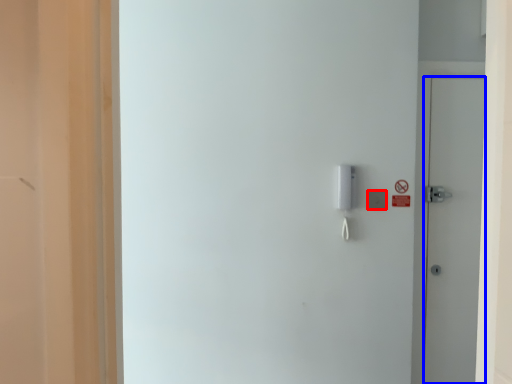
Question: Among these objects, which one is nearest to the camera, light switch (highlighted by a red box) or door (highlighted by a blue box)?

Choices:
 (A) light switch
 (B) door

Answer: (A)